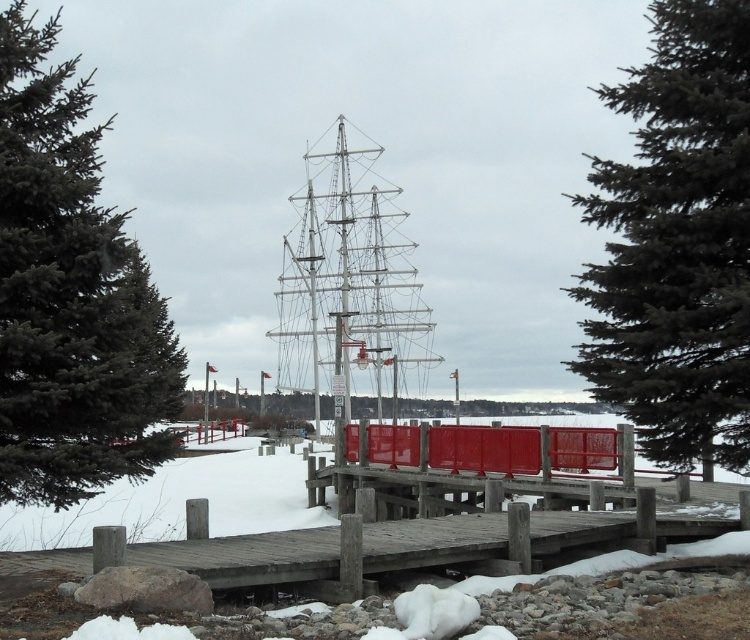
Question: Can you confirm if green matte tree at left is positioned to the left of white metallic boat at center?

Choices:
 (A) yes
 (B) no

Answer: (A)

Question: Is green matte tree at upper right to the left of white metallic boat at center from the viewer's perspective?

Choices:
 (A) no
 (B) yes

Answer: (A)

Question: Which object is closer to the camera taking this photo?

Choices:
 (A) green matte tree at upper right
 (B) wooden dock at center

Answer: (A)

Question: Which point is closer to the camera?

Choices:
 (A) (4, 90)
 (B) (350, 192)

Answer: (A)

Question: Is green matte tree at upper right bigger than white metallic boat at center?

Choices:
 (A) no
 (B) yes

Answer: (B)

Question: Which of the following is the closest to the observer?

Choices:
 (A) (378, 316)
 (B) (740, 166)
 (C) (68, 572)
 (D) (0, 456)

Answer: (C)